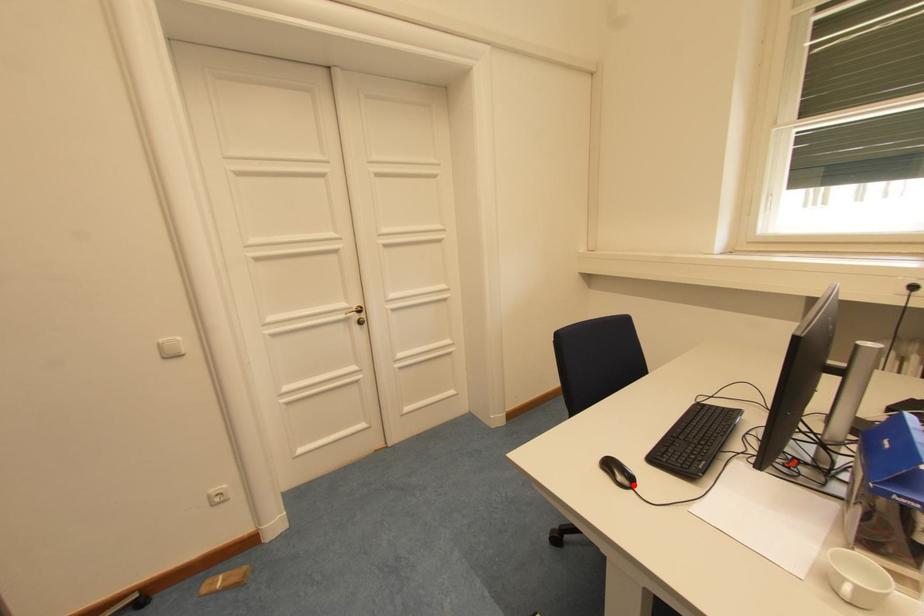
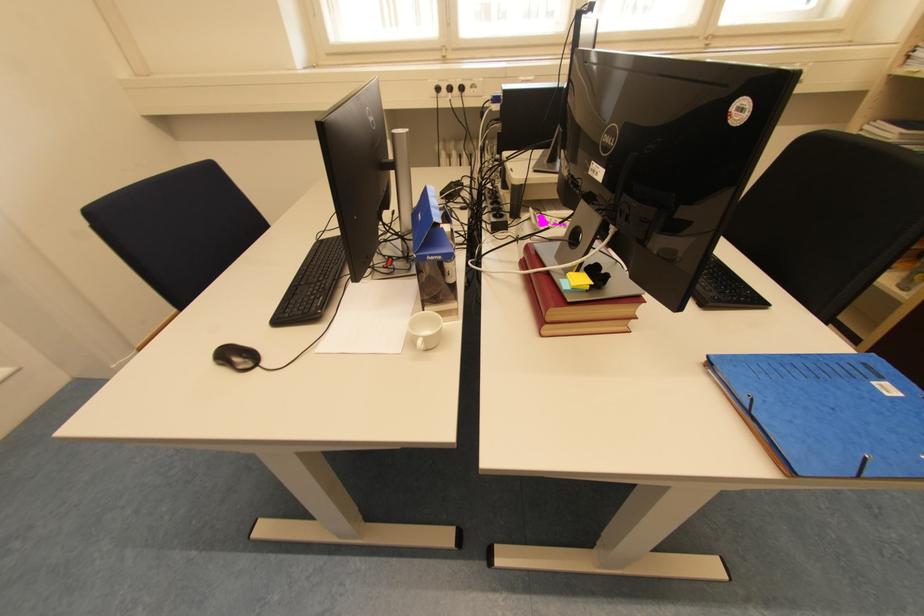
Find the pixel in the second image that matches the highlighted location in the first image.

(256, 365)